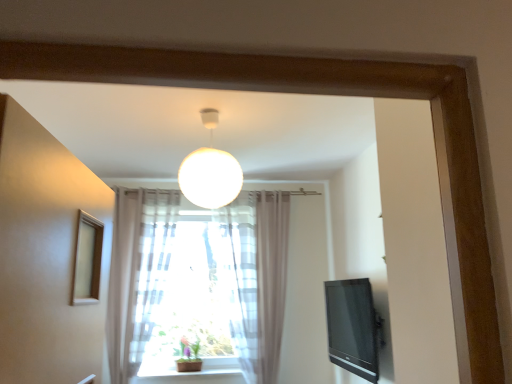
Question: Is black glossy tv at right to the left of green matte plant at center from the viewer's perspective?

Choices:
 (A) yes
 (B) no

Answer: (B)

Question: Considering the relative sizes of black glossy tv at right and green matte plant at center in the image provided, is black glossy tv at right bigger than green matte plant at center?

Choices:
 (A) yes
 (B) no

Answer: (A)

Question: Can you see black glossy tv at right touching green matte plant at center?

Choices:
 (A) no
 (B) yes

Answer: (A)

Question: Does black glossy tv at right have a lesser width compared to green matte plant at center?

Choices:
 (A) no
 (B) yes

Answer: (B)

Question: Can you confirm if black glossy tv at right is smaller than green matte plant at center?

Choices:
 (A) no
 (B) yes

Answer: (A)

Question: Is black glossy tv at right positioned before green matte plant at center?

Choices:
 (A) no
 (B) yes

Answer: (B)

Question: Can you confirm if translucent fabric curtain at lower center is positioned to the right of green matte plant at center?

Choices:
 (A) no
 (B) yes

Answer: (A)

Question: Is translucent fabric curtain at lower center oriented towards green matte plant at center?

Choices:
 (A) yes
 (B) no

Answer: (B)

Question: Is translucent fabric curtain at lower center thinner than green matte plant at center?

Choices:
 (A) yes
 (B) no

Answer: (B)

Question: Is translucent fabric curtain at lower center not within green matte plant at center?

Choices:
 (A) yes
 (B) no

Answer: (A)

Question: Are translucent fabric curtain at lower center and green matte plant at center beside each other?

Choices:
 (A) no
 (B) yes

Answer: (A)

Question: Can you confirm if translucent fabric curtain at lower center is smaller than green matte plant at center?

Choices:
 (A) no
 (B) yes

Answer: (A)

Question: Can you confirm if green matte plant at center is bigger than black glossy tv at right?

Choices:
 (A) no
 (B) yes

Answer: (A)